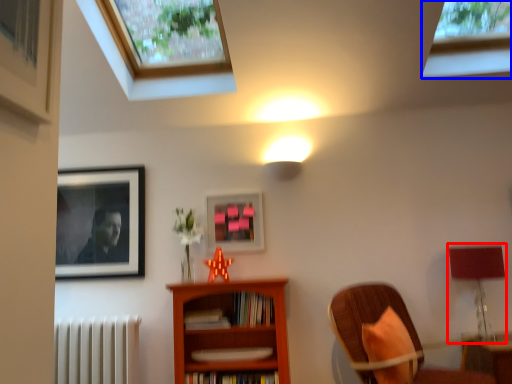
Question: Which object is further to the camera taking this photo, table lamp (highlighted by a red box) or window (highlighted by a blue box)?

Choices:
 (A) table lamp
 (B) window

Answer: (A)